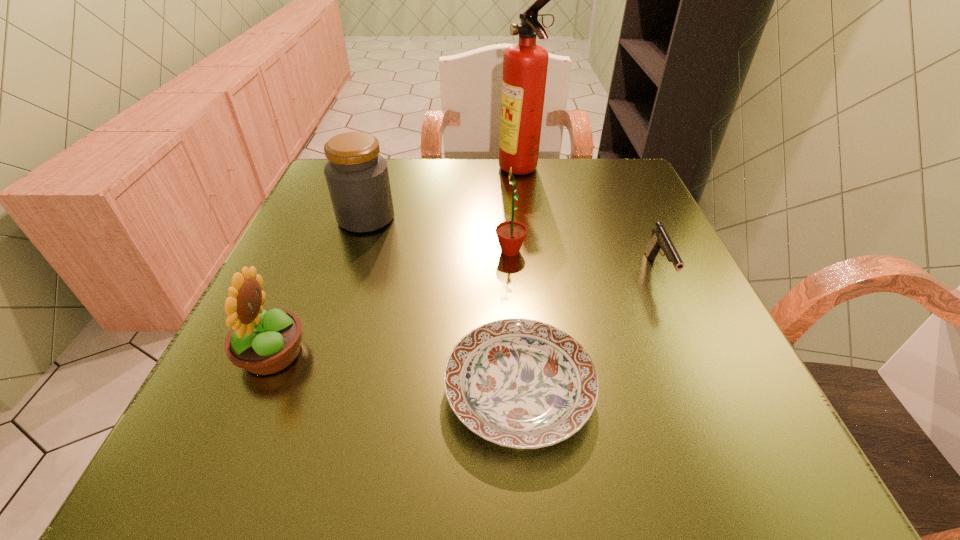
Find the location of a particular element. The height and width of the screenshot is (540, 960). object that is the fourth nearest to the pistol is located at coordinates (357, 177).

The image size is (960, 540). What are the coordinates of `free space that satisfies the following two spatial constraints: 1. on the face of the shortest object; 2. on the right side of the left sunflower` in the screenshot? It's located at (256, 390).

Locate an element on the screen. free region that satisfies the following two spatial constraints: 1. on the back side of the plate; 2. on the face of the nearer sunflower is located at coordinates (516, 354).